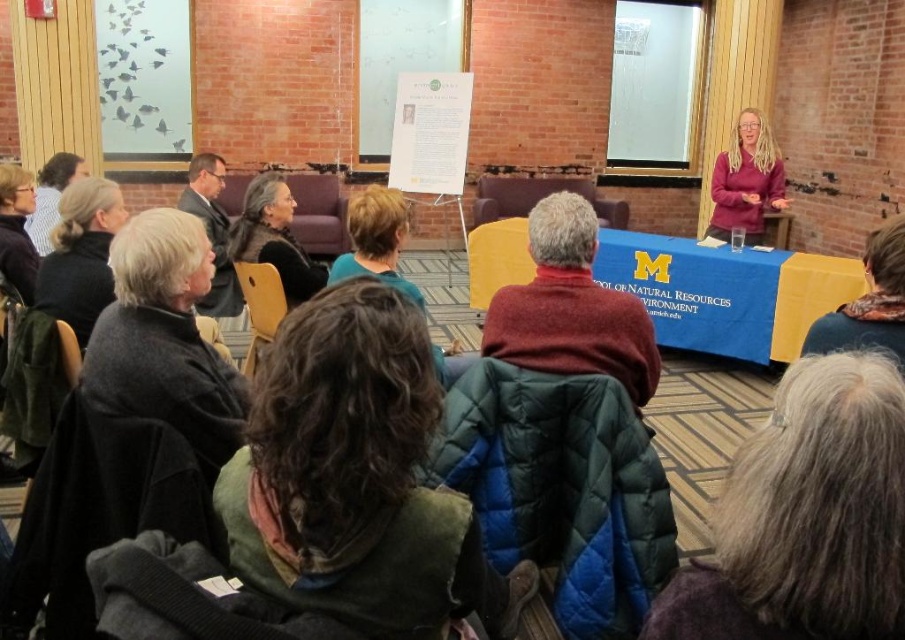
You are an event organizer who needs to seat a guest with a wheelchair in the front row. The wheelchair requires 3 feet of space. Looking at the front row, are the two attendees wearing matte black suit at left and matte black jacket at left close enough to allow the wheelchair to fit between them?

The matte black suit at left and matte black jacket at left are 3.34 feet apart, so yes, the wheelchair can fit between them since the space is slightly larger than the required 3 feet.

You are sitting at point (68, 156) and want to walk to the exit located at point (169, 353). Is the exit in front of you or behind you?

The exit at point (169, 353) is in front of you because it is located in front of your current position at point (68, 156).

You are organizing a winter event and want to ensure that all attendees have accessories that match their attire. If you have a gray woolen scarf at lower right and a matte black suit at left, which accessory is shorter and needs to be paired with a longer coat?

The gray woolen scarf at lower right is shorter than the matte black suit at left, so it needs to be paired with a longer coat to ensure proper length matching.